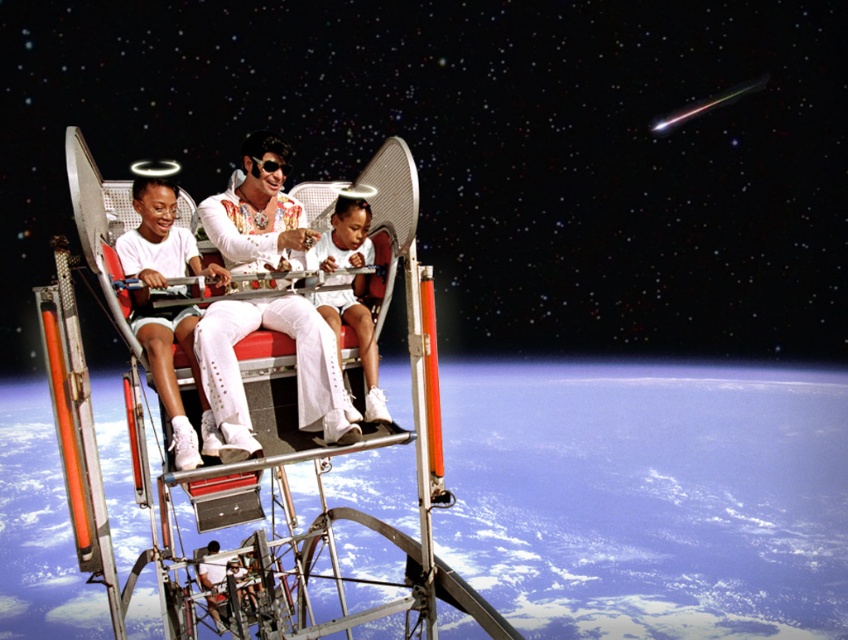
Is point (235, 401) behind point (144, 212)?

That is False.

Is point (283, 257) positioned in front of point (215, 428)?

No, it is behind (215, 428).

Identify the location of white satin suit at center. (296, 369).

Does white satin suit at center appear over white glossy shirt at center?

Correct, white satin suit at center is located above white glossy shirt at center.

Is white satin suit at center to the left of white glossy shirt at center from the viewer's perspective?

Correct, you'll find white satin suit at center to the left of white glossy shirt at center.

Does point (201, 330) come in front of point (361, 244)?

Yes, it is.

Find the location of a particular element. This screenshot has width=848, height=640. white satin suit at center is located at coordinates tap(296, 369).

Is point (205, 432) positioned in front of point (347, 216)?

Yes, it is in front of point (347, 216).

Is white matte shorts at left bigger than white glossy shirt at center?

Indeed, white matte shorts at left has a larger size compared to white glossy shirt at center.

This screenshot has width=848, height=640. Find the location of `white matte shorts at left`. white matte shorts at left is located at coordinates (160, 241).